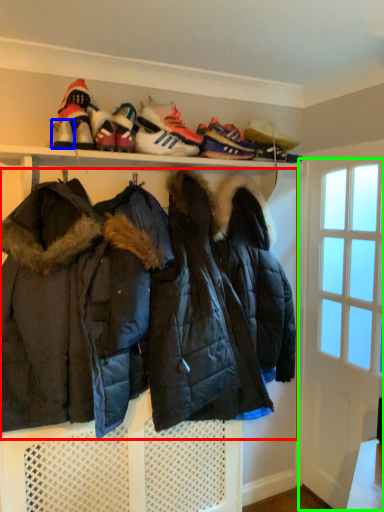
Question: Which is farther away from jacket (highlighted by a red box)? shoe (highlighted by a blue box) or door (highlighted by a green box)?

Choices:
 (A) shoe
 (B) door

Answer: (A)